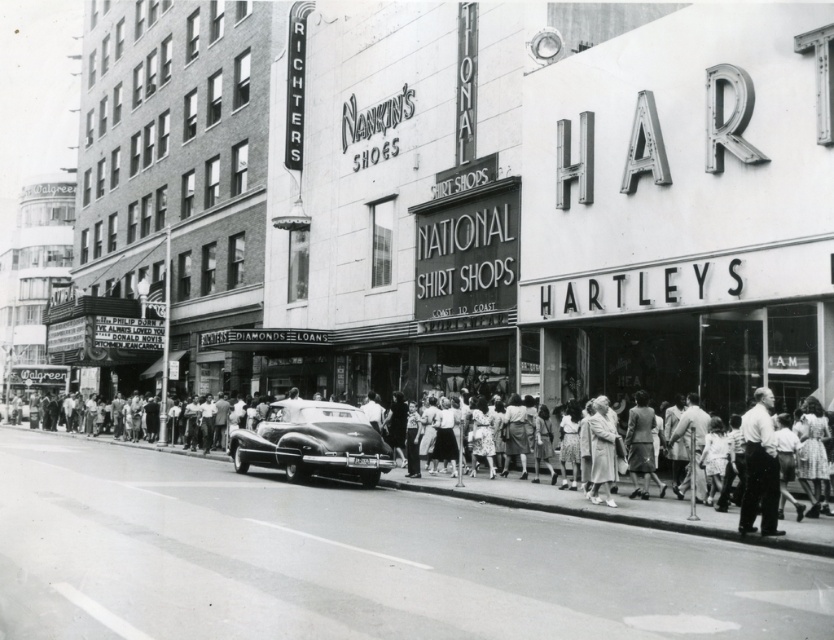
Between shiny black car at center and white cotton shirt at center, which one appears on the right side from the viewer's perspective?

Positioned to the right is white cotton shirt at center.

Can you confirm if shiny black car at center is smaller than white cotton shirt at center?

Correct, shiny black car at center occupies less space than white cotton shirt at center.

Image resolution: width=834 pixels, height=640 pixels. Describe the element at coordinates (312, 442) in the screenshot. I see `shiny black car at center` at that location.

The image size is (834, 640). Identify the location of shiny black car at center. (312, 442).